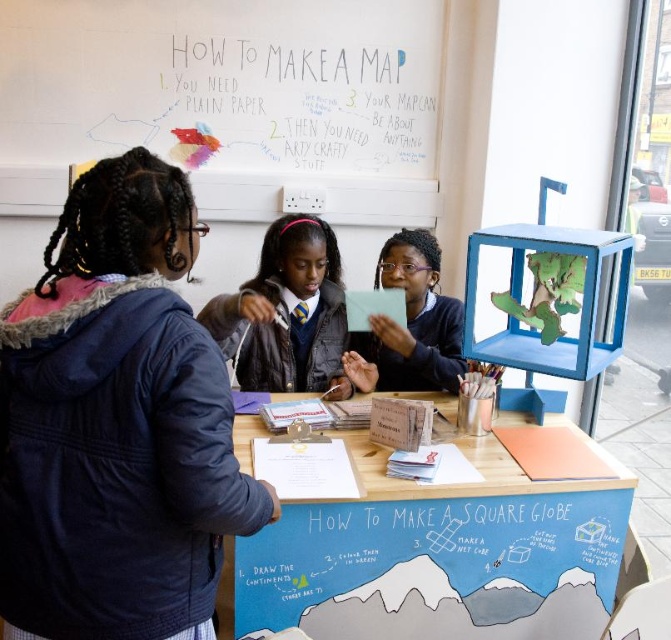
You are a tailor measuring jackets for alterations. You have a navy blue jacket at left and a matte black jacket at center. Which jacket requires more fabric for the sleeves?

The matte black jacket at center requires more fabric for the sleeves since it is larger than the navy blue jacket at left.